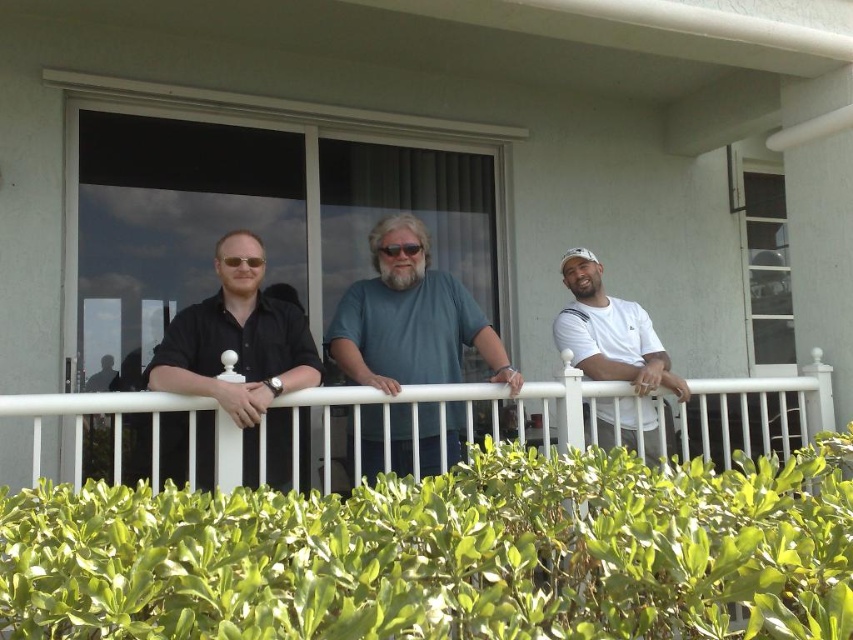
Question: Which point is closer to the camera taking this photo?

Choices:
 (A) (244, 289)
 (B) (563, 272)
 (C) (231, 458)

Answer: (C)

Question: Which object is closer to the camera taking this photo?

Choices:
 (A) white metal railing at center
 (B) teal matte shirt at center
 (C) black matte shirt at center

Answer: (A)

Question: Can you confirm if white metal railing at center is positioned to the right of teal matte shirt at center?

Choices:
 (A) yes
 (B) no

Answer: (A)

Question: Is matte black shirt at center above white matte t-shirt at center?

Choices:
 (A) yes
 (B) no

Answer: (B)

Question: Among these points, which one is farthest from the camera?

Choices:
 (A) (488, 337)
 (B) (520, 432)

Answer: (A)

Question: Where is black matte shirt at center located in relation to teal matte shirt at center in the image?

Choices:
 (A) left
 (B) right

Answer: (A)